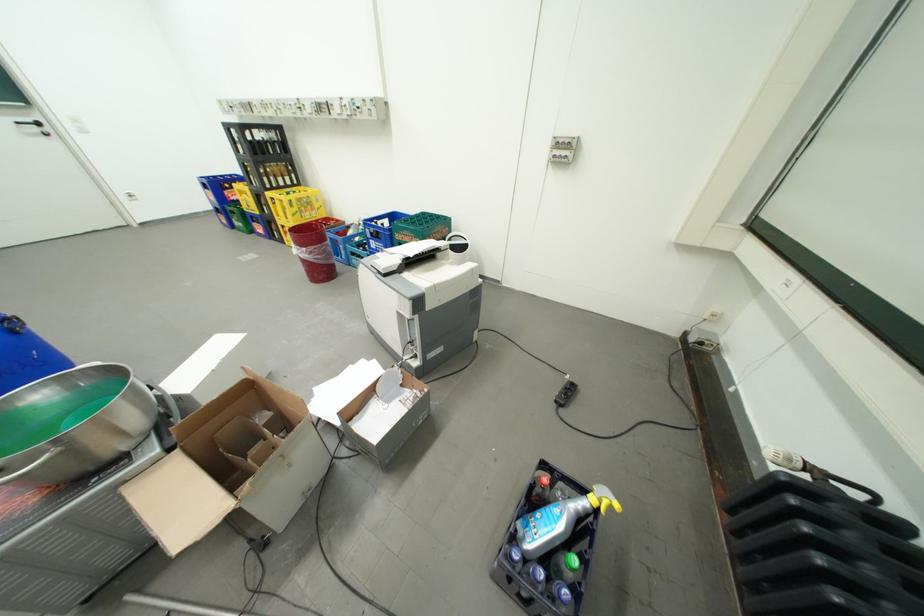
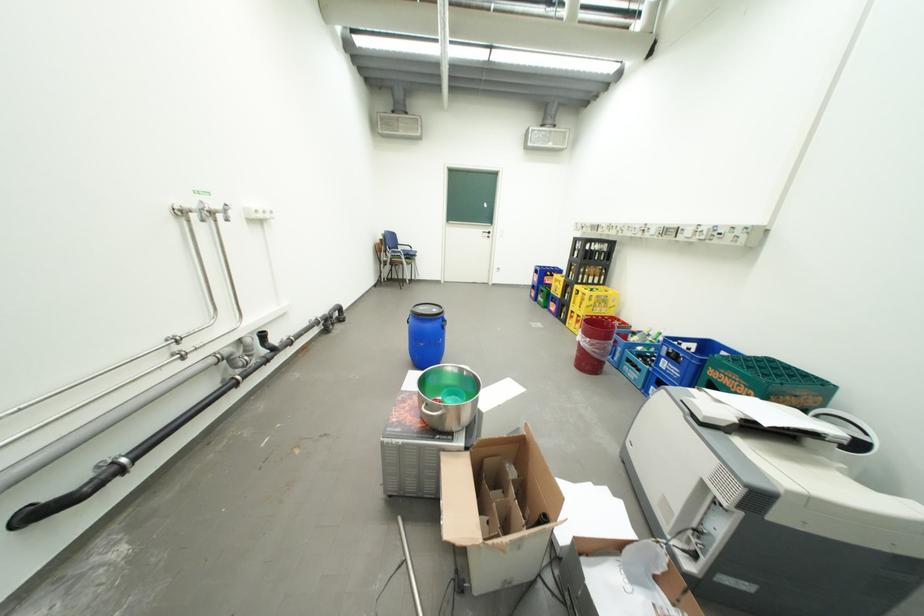
Find the pixel in the second image that matches point (381, 241) in the first image.

(674, 361)